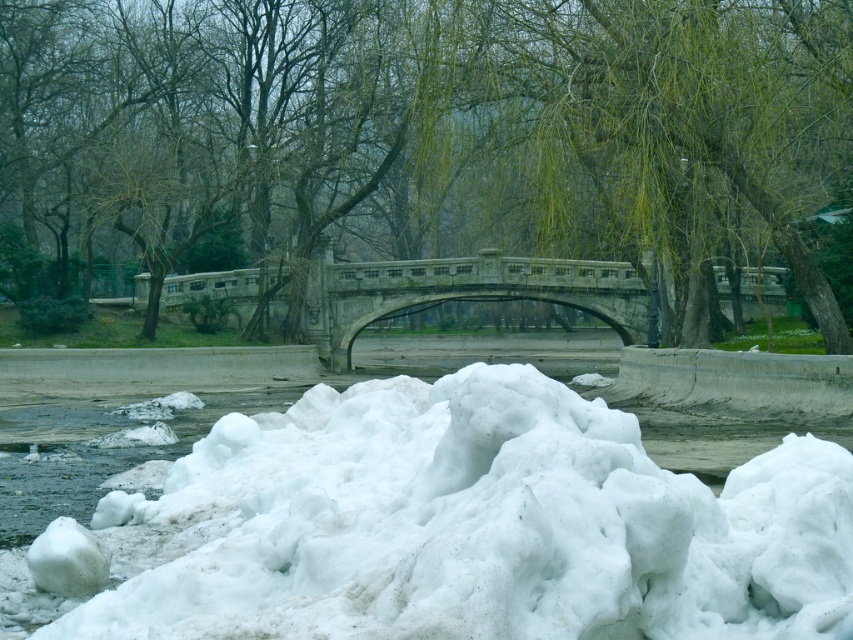
You are a photographer standing at the edge of the water in the winter scene. You want to capture a photo of the stone bridge at center and the white fluffy snow at center. Which object will appear taller in the photo?

The stone bridge at center will appear taller in the photo because the white fluffy snow at center is shorter than the stone bridge at center.

You are a bird flying over the winter scene and want to land on the highest point between the green leafy tree at center and the white fluffy snow at center. Which one should you choose?

The green leafy tree at center is much taller than the white fluffy snow at center, so you should choose the green leafy tree at center to land on the highest point.